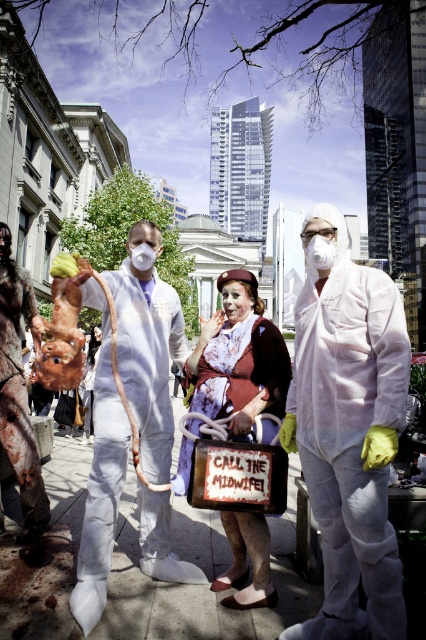
Does matte brown dress at center have a lesser height compared to rusty metal pig at left?

In fact, matte brown dress at center may be taller than rusty metal pig at left.

Can you confirm if matte brown dress at center is wider than rusty metal pig at left?

Yes.

What do you see at coordinates (238, 358) in the screenshot? I see `matte brown dress at center` at bounding box center [238, 358].

Locate an element on the screen. matte brown dress at center is located at coordinates (238, 358).

Who is taller, white matte hazmat suit at center or matte brown dress at center?

white matte hazmat suit at center is taller.

Does white matte hazmat suit at center come in front of matte brown dress at center?

Yes, white matte hazmat suit at center is in front of matte brown dress at center.

Find the location of `white matte hazmat suit at center`. white matte hazmat suit at center is located at coordinates (348, 428).

In the scene shown: Who is positioned more to the right, white matte/latex rubber prosthetic at center or rusty metal pig at left?

white matte/latex rubber prosthetic at center is more to the right.

Who is lower down, white matte/latex rubber prosthetic at center or rusty metal pig at left?

white matte/latex rubber prosthetic at center is lower down.

Is point (178, 564) positioned in front of point (3, 328)?

Yes, point (178, 564) is closer to viewer.

Find the location of a particular element. This screenshot has width=426, height=640. white matte/latex rubber prosthetic at center is located at coordinates (149, 358).